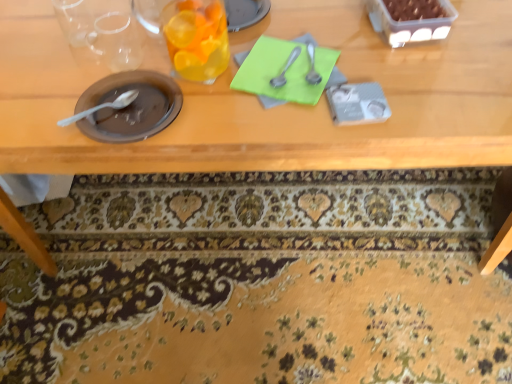
What are the coordinates of `free spot behind matte brown plate at left, the first tableware viewed from the left` in the screenshot? It's located at (121, 52).